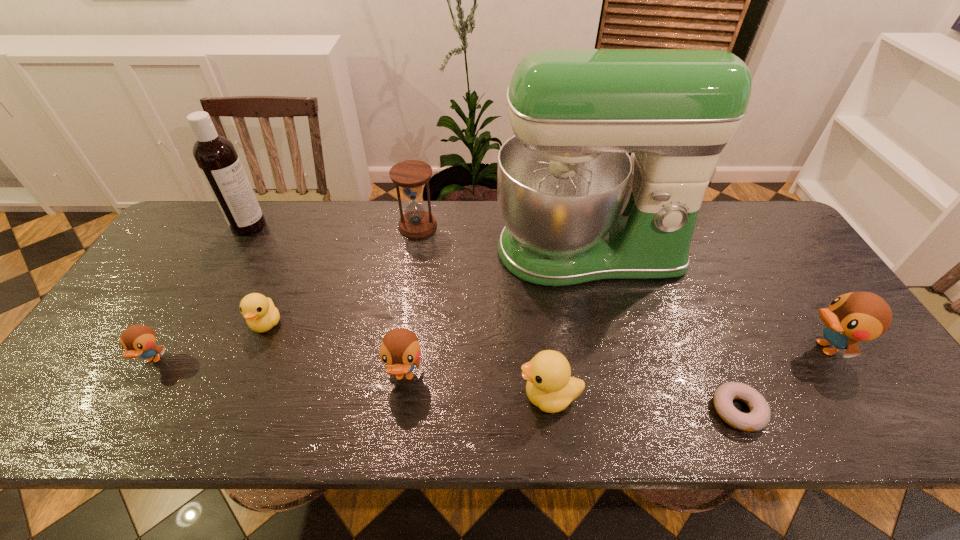
You are a GUI agent. You are given a task and a screenshot of the screen. Output one action in this format:
    pyautogui.click(x=<x>, y=<y>)
    Task: Click on the free space between the hourglass and the eighth shortest object
    
    Given the screenshot: What is the action you would take?
    pyautogui.click(x=333, y=226)

Find the location of a particular element. free space that is in between the seventh object from right to left and the hourglass is located at coordinates (342, 275).

Locate an element on the screen. This screenshot has height=540, width=960. free space between the smallest blue duck and the hourglass is located at coordinates (285, 293).

You are a GUI agent. You are given a task and a screenshot of the screen. Output one action in this format:
    pyautogui.click(x=<x>, y=<y>)
    Task: Click on the vacant space that is in between the shortest object and the second tallest object
    
    Given the screenshot: What is the action you would take?
    pyautogui.click(x=493, y=318)

The width and height of the screenshot is (960, 540). In order to click on blank region between the tallest duck and the leftmost duck in this screenshot , I will do `click(489, 354)`.

You are a GUI agent. You are given a task and a screenshot of the screen. Output one action in this format:
    pyautogui.click(x=<x>, y=<y>)
    Task: Click on the vacant space in between the tallest object and the bigger yellow duck
    This screenshot has width=960, height=540.
    Given the screenshot: What is the action you would take?
    pyautogui.click(x=568, y=323)

Identify the location of free space that is in between the doughnut and the hourglass. (578, 318).

Where is `vacant area that lies between the left yellow duck and the doughnut`? Image resolution: width=960 pixels, height=540 pixels. vacant area that lies between the left yellow duck and the doughnut is located at coordinates (502, 367).

This screenshot has width=960, height=540. In order to click on vacant area between the smaller yellow duck and the second smallest blue duck in this screenshot , I will do `click(336, 350)`.

At what (x,y) coordinates should I click in order to perform the action: click on free space between the fourth duck from left to right and the rightmost duck. Please return your answer as a coordinate pair (x, y). The width and height of the screenshot is (960, 540). Looking at the image, I should click on (686, 372).